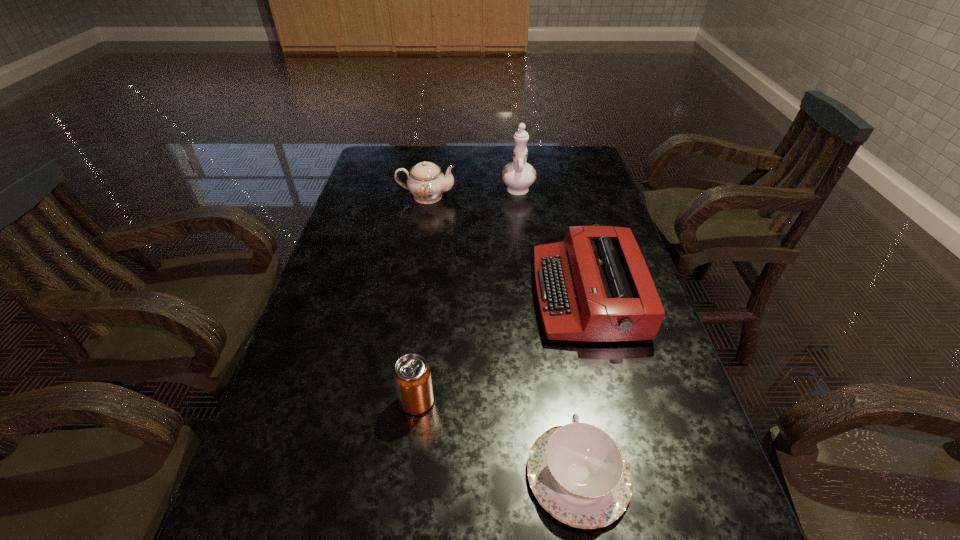
You are a GUI agent. You are given a task and a screenshot of the screen. Output one action in this format:
    pyautogui.click(x=<x>, y=<y>)
    Task: Click on the vacant space that is in between the shortest chinaware and the leftmost chinaware
    Image resolution: width=960 pixels, height=540 pixels.
    Given the screenshot: What is the action you would take?
    pyautogui.click(x=502, y=336)

The width and height of the screenshot is (960, 540). I want to click on vacant space in between the tallest object and the typewriter, so click(x=552, y=241).

Locate which object is the fourth closest to the fifth tallest object. Please provide its 2D coordinates. Your answer should be formatted as a tuple, i.e. [(x, y)], where the tuple contains the x and y coordinates of a point satisfying the conditions above.

[(426, 182)]

The height and width of the screenshot is (540, 960). I want to click on the second closest object to the nearest chinaware, so click(595, 286).

Identify the location of chinaware object that ranks as the third closest to the fourth farthest object. (518, 175).

Locate an element on the screen. The image size is (960, 540). the second closest chinaware to the nearest object is located at coordinates (426, 182).

Where is `vacant area that satisfies the following two spatial constraints: 1. on the back side of the soda can; 2. at the spout of the second shortest chinaware`? The height and width of the screenshot is (540, 960). vacant area that satisfies the following two spatial constraints: 1. on the back side of the soda can; 2. at the spout of the second shortest chinaware is located at coordinates (441, 197).

The image size is (960, 540). I want to click on vacant area in the image that satisfies the following two spatial constraints: 1. at the spout of the leftmost chinaware; 2. on the right side of the fourth farthest object, so click(x=394, y=401).